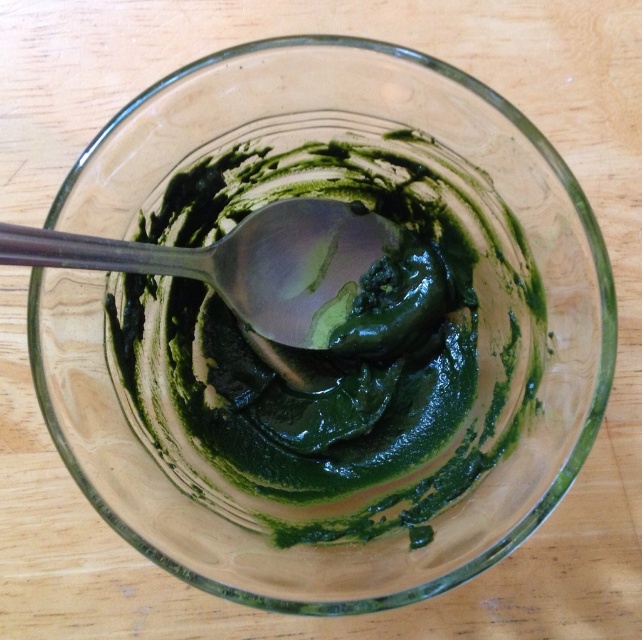
Does green matte paste at center come in front of metallic silver spoon at center?

No, it is not.

Does green matte paste at center have a lesser width compared to metallic silver spoon at center?

No, green matte paste at center is not thinner than metallic silver spoon at center.

Does point (334, 188) come behind point (282, 317)?

Yes.

Where is `green matte paste at center`? Image resolution: width=642 pixels, height=640 pixels. green matte paste at center is located at coordinates (345, 372).